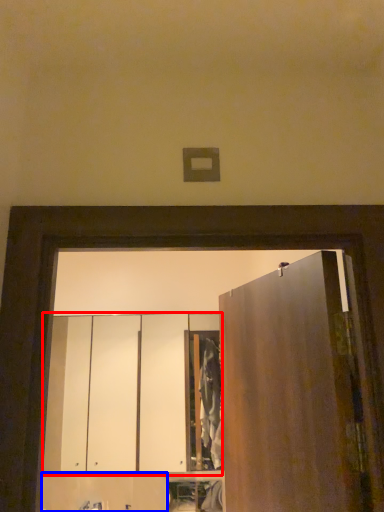
Question: Which object appears farthest to the camera in this image, cabinetry (highlighted by a red box) or cabinetry (highlighted by a blue box)?

Choices:
 (A) cabinetry
 (B) cabinetry

Answer: (A)